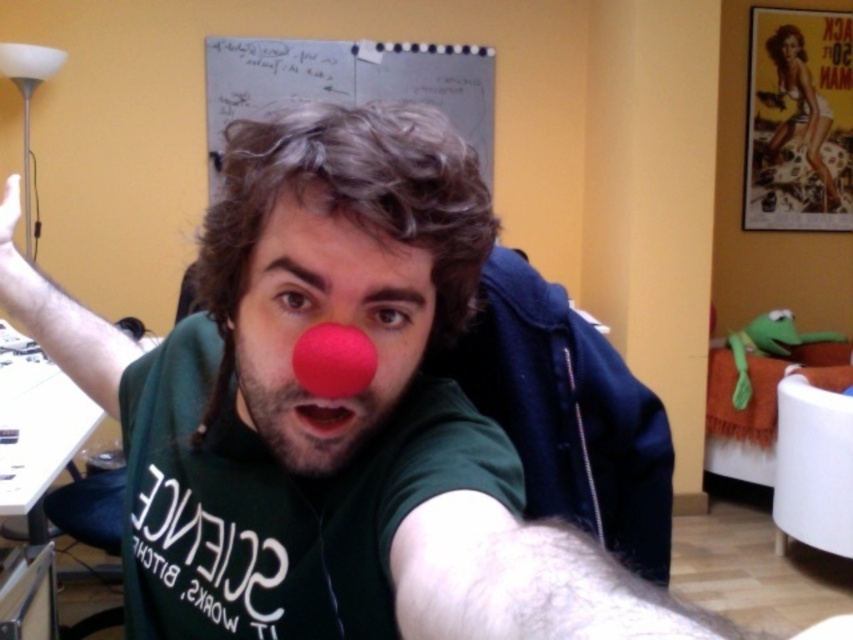
Question: Which object is farther from the camera taking this photo?

Choices:
 (A) matte red nose at center
 (B) rubber-like red nose at center

Answer: (A)

Question: Which point is closer to the camera?

Choices:
 (A) matte red nose at center
 (B) rubber-like red nose at center

Answer: (B)

Question: Is matte red nose at center thinner than rubber-like red nose at center?

Choices:
 (A) no
 (B) yes

Answer: (A)

Question: Where is matte red nose at center located in relation to rubber-like red nose at center in the image?

Choices:
 (A) right
 (B) left

Answer: (B)

Question: Considering the real-world distances, which object is closest to the smooth matte red nose at center?

Choices:
 (A) matte red nose at center
 (B) rubber-like red nose at center

Answer: (B)

Question: Is rubber-like red nose at center closer to camera compared to smooth matte red nose at center?

Choices:
 (A) yes
 (B) no

Answer: (A)